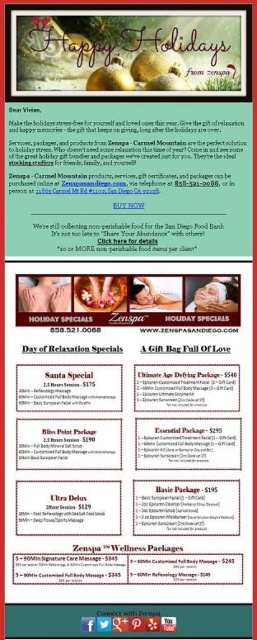
You are a customer looking at the Zenspa promotional flyer. You notice two items at the center of the flyer. Which item is positioned lower between the matte black gift bag at center and the matte pink nail polish at center?

The matte black gift bag at center is located below the matte pink nail polish at center, so it is positioned lower.

You are a customer at Zenspa and see the matte black gift bag at center and the matte pink nail polish at center on the table. Which item is wider?

The matte black gift bag at center is wider than the matte pink nail polish at center.